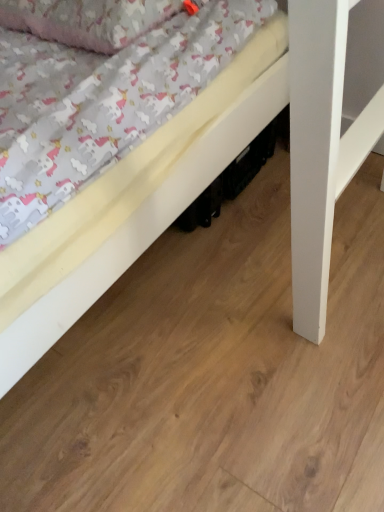
Question: Considering their positions, is fluffy cotton pillow at upper left located in front of or behind white matte bed at lower left?

Choices:
 (A) front
 (B) behind

Answer: (B)

Question: Is point click(x=3, y=0) positioned closer to the camera than point click(x=135, y=250)?

Choices:
 (A) farther
 (B) closer

Answer: (A)

Question: In terms of size, does fluffy cotton pillow at upper left appear bigger or smaller than white matte bed at lower left?

Choices:
 (A) small
 (B) big

Answer: (A)

Question: From a real-world perspective, is white matte bed at lower left physically located above or below fluffy cotton pillow at upper left?

Choices:
 (A) above
 (B) below

Answer: (B)

Question: Relative to fluffy cotton pillow at upper left, is white matte bed at lower left in front or behind?

Choices:
 (A) front
 (B) behind

Answer: (A)

Question: Looking at the image, does white matte bed at lower left seem bigger or smaller compared to fluffy cotton pillow at upper left?

Choices:
 (A) small
 (B) big

Answer: (B)

Question: In terms of height, does white matte bed at lower left look taller or shorter compared to fluffy cotton pillow at upper left?

Choices:
 (A) short
 (B) tall

Answer: (A)